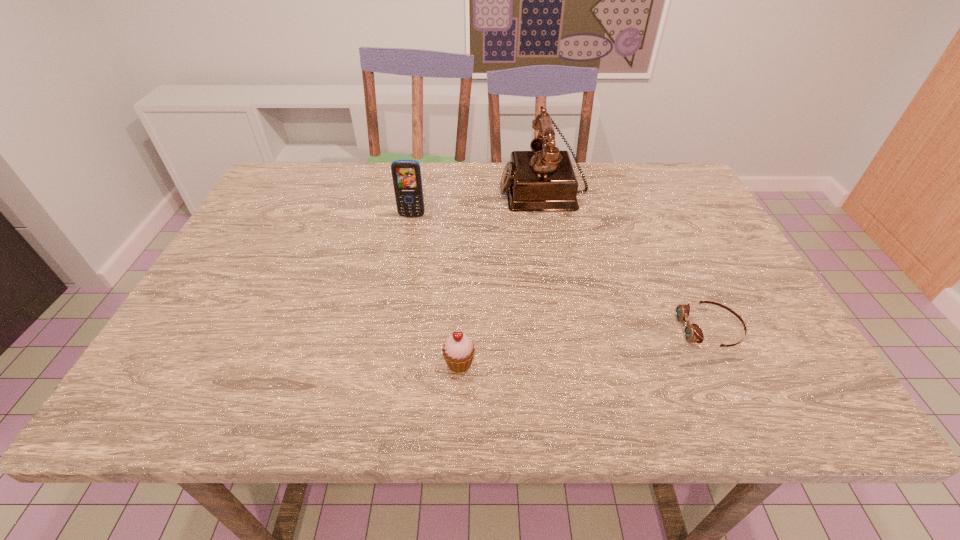
Locate an element on the screen. The image size is (960, 540). free region at the near edge is located at coordinates (361, 389).

Find the location of a particular element. The height and width of the screenshot is (540, 960). free point at the left edge is located at coordinates (289, 225).

Find the location of a particular element. free space at the right edge of the desktop is located at coordinates (672, 251).

Locate an element on the screen. vacant space at the far right corner is located at coordinates [x=682, y=186].

Where is `vacant space at the near right corner of the desktop`? vacant space at the near right corner of the desktop is located at coordinates (743, 411).

Where is `free spot between the telephone and the leftmost object`? The width and height of the screenshot is (960, 540). free spot between the telephone and the leftmost object is located at coordinates (477, 202).

Find the location of a particular element. This screenshot has height=540, width=960. free area in between the cellular telephone and the tallest object is located at coordinates (477, 202).

Where is `free spot between the third object from left to right and the cupcake`? free spot between the third object from left to right and the cupcake is located at coordinates (501, 275).

Image resolution: width=960 pixels, height=540 pixels. Identify the location of free space between the second tallest object and the third object from right to left. (436, 289).

I want to click on empty location between the leftmost object and the tallest object, so click(x=477, y=202).